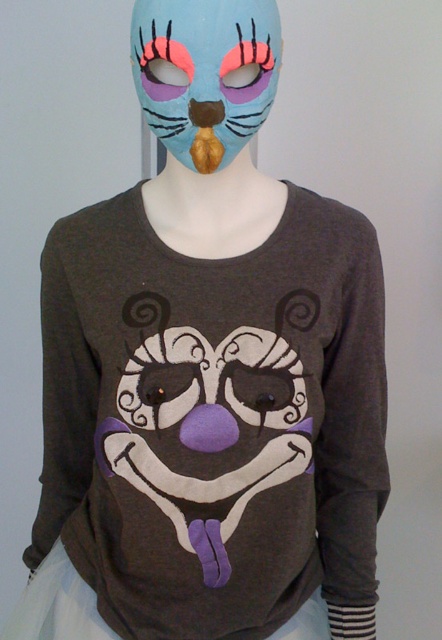
You are a fashion designer looking at the mannequin. You need to determine the spatial relationship between the matte gray sweatshirt at center and the matte blue mask at upper center. Which object is positioned higher on the mannequin?

The matte blue mask at upper center is positioned higher than the matte gray sweatshirt at center.

You are an artist trying to sketch the mannequin from the image. You want to draw the matte gray sweatshirt at center first. Should you draw it before or after the matte blue mask at upper center?

The matte gray sweatshirt at center is further to the viewer than the matte blue mask at upper center, so you should draw the matte gray sweatshirt at center first before the matte blue mask at upper center.

You are an assistant helping to organize a costume party. You see a mannequin with a dark gray long sleeve shirt and a light blue cat mask. There is also a point marked at coordinates (213, 419). What object is located at that point?

The point at coordinates (213, 419) corresponds to the matte gray sweatshirt at center.